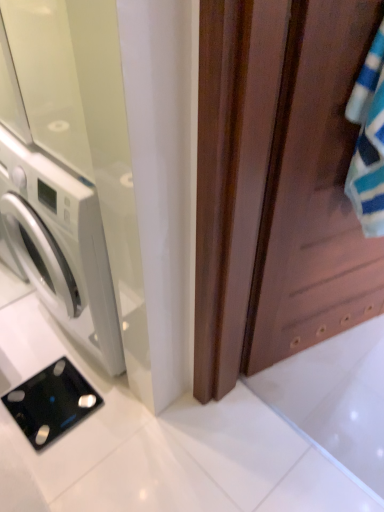
Image resolution: width=384 pixels, height=512 pixels. Describe the element at coordinates (314, 193) in the screenshot. I see `brown wooden screen door at right, the first screen door in the right-to-left sequence` at that location.

The width and height of the screenshot is (384, 512). Find the location of `black glass scale at lower left`. black glass scale at lower left is located at coordinates (x=51, y=402).

Is white glossy door at left, the 2th screen door in the right-to-left sequence, smaller than brown wooden screen door at right, placed as the 2th screen door when sorted from left to right?

No.

Which is more to the right, white glossy door at left, the 2th screen door in the right-to-left sequence, or brown wooden screen door at right, placed as the 2th screen door when sorted from left to right?

brown wooden screen door at right, placed as the 2th screen door when sorted from left to right, is more to the right.

Is white glossy door at left, arranged as the 1th screen door when viewed from the left, positioned far away from brown wooden screen door at right, the first screen door in the right-to-left sequence?

No, white glossy door at left, arranged as the 1th screen door when viewed from the left, is in close proximity to brown wooden screen door at right, the first screen door in the right-to-left sequence.

Is white glossy door at left, the 2th screen door in the right-to-left sequence, bigger or smaller than black glass scale at lower left?

Clearly, white glossy door at left, the 2th screen door in the right-to-left sequence, is larger in size than black glass scale at lower left.

Is point (146, 369) positioned after point (54, 398)?

No, (146, 369) is closer to viewer.

Which object is positioned more to the right, white glossy door at left, arranged as the 1th screen door when viewed from the left, or black glass scale at lower left?

white glossy door at left, arranged as the 1th screen door when viewed from the left, is more to the right.

Does point (343, 110) come closer to viewer compared to point (24, 404)?

That is True.

I want to click on screen door that is the 2nd object above the black glass scale at lower left (from a real-world perspective), so click(x=314, y=193).

From the image's perspective, who appears lower, brown wooden screen door at right, placed as the 2th screen door when sorted from left to right, or black glass scale at lower left?

black glass scale at lower left appears lower in the image.

Between brown wooden screen door at right, placed as the 2th screen door when sorted from left to right, and black glass scale at lower left, which one appears on the right side from the viewer's perspective?

Positioned to the right is brown wooden screen door at right, placed as the 2th screen door when sorted from left to right.

Is black glass scale at lower left spatially inside brown wooden screen door at right, the first screen door in the right-to-left sequence, or outside of it?

black glass scale at lower left is not inside brown wooden screen door at right, the first screen door in the right-to-left sequence, it's outside.

From the image's perspective, would you say black glass scale at lower left is positioned over brown wooden screen door at right, placed as the 2th screen door when sorted from left to right?

No, from the image's perspective, black glass scale at lower left is not over brown wooden screen door at right, placed as the 2th screen door when sorted from left to right.

How many degrees apart are the facing directions of black glass scale at lower left and brown wooden screen door at right, the first screen door in the right-to-left sequence?

The angle between the facing direction of black glass scale at lower left and the facing direction of brown wooden screen door at right, the first screen door in the right-to-left sequence, is 87.2 degrees.

Consider the image. Can you confirm if black glass scale at lower left is bigger than brown wooden screen door at right, the first screen door in the right-to-left sequence?

Actually, black glass scale at lower left might be smaller than brown wooden screen door at right, the first screen door in the right-to-left sequence.

Could you measure the distance between black glass scale at lower left and white glossy door at left, the 2th screen door in the right-to-left sequence?

They are 23.19 inches apart.

Which object is thinner, black glass scale at lower left or white glossy door at left, the 2th screen door in the right-to-left sequence?

black glass scale at lower left.

Considering the sizes of objects black glass scale at lower left and white glossy door at left, the 2th screen door in the right-to-left sequence, in the image provided, who is shorter, black glass scale at lower left or white glossy door at left, the 2th screen door in the right-to-left sequence,?

Standing shorter between the two is black glass scale at lower left.

Does black glass scale at lower left turn towards white glossy door at left, the 2th screen door in the right-to-left sequence?

No, black glass scale at lower left does not turn towards white glossy door at left, the 2th screen door in the right-to-left sequence.

Considering the points (302, 175) and (145, 324), which point is behind, point (302, 175) or point (145, 324)?

The point (145, 324) is behind.

What's the angular difference between brown wooden screen door at right, placed as the 2th screen door when sorted from left to right, and white glossy door at left, arranged as the 1th screen door when viewed from the left,'s facing directions?

brown wooden screen door at right, placed as the 2th screen door when sorted from left to right, and white glossy door at left, arranged as the 1th screen door when viewed from the left, are facing 87.2 degrees away from each other.

From a real-world perspective, who is located higher, brown wooden screen door at right, placed as the 2th screen door when sorted from left to right, or white glossy door at left, arranged as the 1th screen door when viewed from the left?

brown wooden screen door at right, placed as the 2th screen door when sorted from left to right, from a real-world perspective.

Is white glossy door at left, the 2th screen door in the right-to-left sequence, at the back of brown wooden screen door at right, the first screen door in the right-to-left sequence?

No, brown wooden screen door at right, the first screen door in the right-to-left sequence,'s orientation is not away from white glossy door at left, the 2th screen door in the right-to-left sequence.

Image resolution: width=384 pixels, height=512 pixels. In order to click on screen door that is below the brown wooden screen door at right, the first screen door in the right-to-left sequence (from the image's perspective) in this screenshot , I will do `click(78, 167)`.

The width and height of the screenshot is (384, 512). In order to click on the 1st screen door above when counting from the black glass scale at lower left (from the image's perspective) in this screenshot , I will do coord(78,167).

From the image, which object appears to be nearer to brown wooden screen door at right, the first screen door in the right-to-left sequence, black glass scale at lower left or white glossy door at left, the 2th screen door in the right-to-left sequence?

Based on the image, white glossy door at left, the 2th screen door in the right-to-left sequence, appears to be nearer to brown wooden screen door at right, the first screen door in the right-to-left sequence.

Considering their positions, is brown wooden screen door at right, placed as the 2th screen door when sorted from left to right, positioned closer to black glass scale at lower left than white glossy door at left, arranged as the 1th screen door when viewed from the left?

white glossy door at left, arranged as the 1th screen door when viewed from the left, is positioned closer to the anchor black glass scale at lower left.

When comparing their distances from brown wooden screen door at right, placed as the 2th screen door when sorted from left to right, does white glossy door at left, arranged as the 1th screen door when viewed from the left, or black glass scale at lower left seem closer?

Based on the image, white glossy door at left, arranged as the 1th screen door when viewed from the left, appears to be nearer to brown wooden screen door at right, placed as the 2th screen door when sorted from left to right.

Looking at the image, which one is located closer to white glossy door at left, the 2th screen door in the right-to-left sequence, black glass scale at lower left or brown wooden screen door at right, the first screen door in the right-to-left sequence?

brown wooden screen door at right, the first screen door in the right-to-left sequence, is closer to white glossy door at left, the 2th screen door in the right-to-left sequence.

From the image, which object appears to be nearer to white glossy door at left, arranged as the 1th screen door when viewed from the left, brown wooden screen door at right, placed as the 2th screen door when sorted from left to right, or black glass scale at lower left?

Based on the image, brown wooden screen door at right, placed as the 2th screen door when sorted from left to right, appears to be nearer to white glossy door at left, arranged as the 1th screen door when viewed from the left.

Considering their positions, is white glossy door at left, the 2th screen door in the right-to-left sequence, positioned further to black glass scale at lower left than brown wooden screen door at right, placed as the 2th screen door when sorted from left to right?

brown wooden screen door at right, placed as the 2th screen door when sorted from left to right, is further to black glass scale at lower left.

Identify the location of screen door between black glass scale at lower left and brown wooden screen door at right, placed as the 2th screen door when sorted from left to right, from left to right. This screenshot has height=512, width=384. (78, 167).